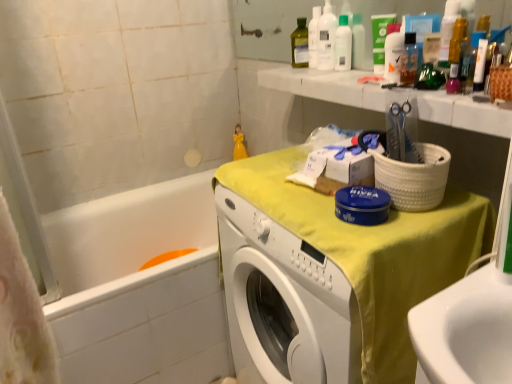
Question: Is green matte tube at upper center placed right next to white glossy bottle at upper center, the 1th cleaning product positioned from the right?

Choices:
 (A) yes
 (B) no

Answer: (A)

Question: Is green matte tube at upper center to the right of white glossy bottle at upper center, which is the second cleaning product in left-to-right order, from the viewer's perspective?

Choices:
 (A) no
 (B) yes

Answer: (A)

Question: Is green matte tube at upper center positioned with its back to white glossy bottle at upper center, the 1th cleaning product positioned from the right?

Choices:
 (A) no
 (B) yes

Answer: (A)

Question: Is green matte tube at upper center shorter than white glossy bottle at upper center, which is the second cleaning product in left-to-right order?

Choices:
 (A) yes
 (B) no

Answer: (B)

Question: Is green matte tube at upper center at the left side of white glossy bottle at upper center, the 1th cleaning product positioned from the right?

Choices:
 (A) no
 (B) yes

Answer: (B)

Question: Does green matte tube at upper center have a lesser width compared to white glossy bottle at upper center, the first cleaning product in the front-to-back sequence?

Choices:
 (A) yes
 (B) no

Answer: (B)

Question: Is yellow fabric-covered washer at center surrounded by white glossy bathtub at lower left?

Choices:
 (A) no
 (B) yes

Answer: (A)

Question: Does white glossy bathtub at lower left have a larger size compared to yellow fabric-covered washer at center?

Choices:
 (A) yes
 (B) no

Answer: (A)

Question: Is white glossy bathtub at lower left in contact with yellow fabric-covered washer at center?

Choices:
 (A) yes
 (B) no

Answer: (B)

Question: From a real-world perspective, is white glossy bathtub at lower left positioned under yellow fabric-covered washer at center based on gravity?

Choices:
 (A) no
 (B) yes

Answer: (B)

Question: Could you tell me if white glossy bathtub at lower left is turned towards yellow fabric-covered washer at center?

Choices:
 (A) yes
 (B) no

Answer: (A)

Question: Considering the relative positions of white glossy bathtub at lower left and yellow fabric-covered washer at center in the image provided, is white glossy bathtub at lower left to the right of yellow fabric-covered washer at center from the viewer's perspective?

Choices:
 (A) no
 (B) yes

Answer: (A)

Question: From the image's perspective, is yellow fabric-covered washer at center above white glossy bottle at upper center, which ranks as the 2th cleaning product in back-to-front order?

Choices:
 (A) yes
 (B) no

Answer: (B)